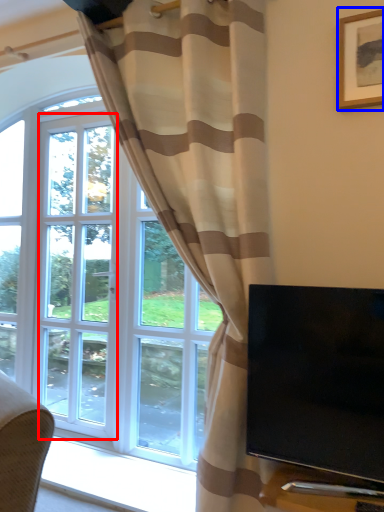
Question: Among these objects, which one is farthest to the camera, screen door (highlighted by a red box) or picture frame (highlighted by a blue box)?

Choices:
 (A) screen door
 (B) picture frame

Answer: (A)